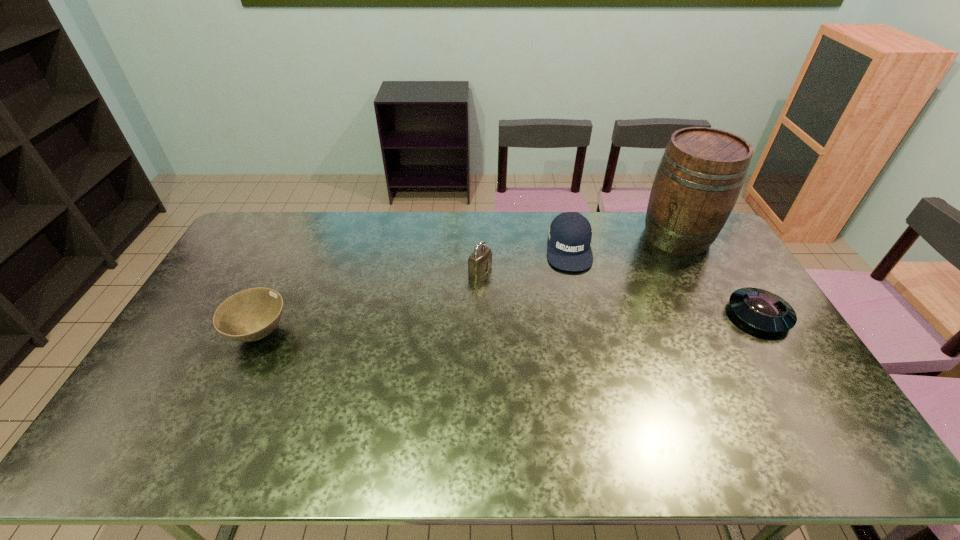
You are a GUI agent. You are given a task and a screenshot of the screen. Output one action in this format:
    pyautogui.click(x=<x>, y=<y>)
    Task: Click on the free spot on the desktop that is between the bowl and the shortest object and is positioned at the front of the padlock near the keyhole
    This screenshot has width=960, height=540.
    Given the screenshot: What is the action you would take?
    pyautogui.click(x=580, y=321)

Where is `vacant space on the desktop that is between the leftmost object and the saucer and is positioned on the front-facing side of the third object from left to right`? This screenshot has width=960, height=540. vacant space on the desktop that is between the leftmost object and the saucer and is positioned on the front-facing side of the third object from left to right is located at coordinates (573, 321).

Image resolution: width=960 pixels, height=540 pixels. I want to click on free space on the desktop that is between the leftmost object and the shortest object and is positioned on the side of the cider near the bung hole, so click(x=572, y=322).